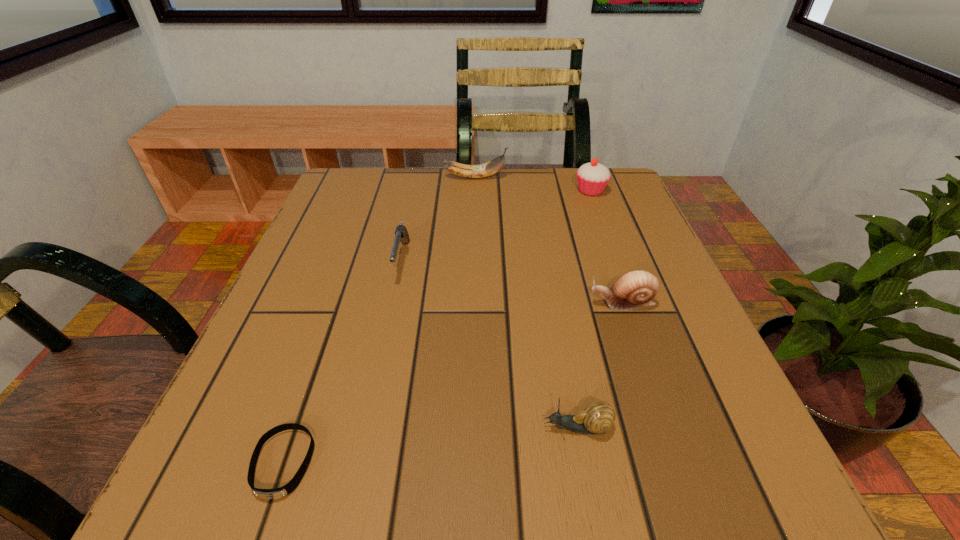
At what (x,y) coordinates should I click in order to perform the action: click on blank space at the left edge of the desktop. Please return your answer as a coordinate pair (x, y). The image size is (960, 540). Looking at the image, I should click on (306, 259).

The height and width of the screenshot is (540, 960). I want to click on vacant region at the right edge of the desktop, so click(716, 362).

Identify the location of blank space at the far left corner. Image resolution: width=960 pixels, height=540 pixels. (354, 180).

Identify the location of vacant space at the far right corner of the desktop. Image resolution: width=960 pixels, height=540 pixels. (635, 212).

Locate an element on the screen. Image resolution: width=960 pixels, height=540 pixels. empty space between the right escargot and the banana is located at coordinates (548, 240).

What are the coordinates of `free space between the right escargot and the left escargot` in the screenshot? It's located at (600, 366).

I want to click on vacant region between the leftmost object and the fourth nearest object, so click(343, 362).

The image size is (960, 540). Identify the location of unoccupied area between the shortest object and the third farthest object. (343, 362).

Find the location of a particular element. The width and height of the screenshot is (960, 540). free space between the farther escargot and the fifth object from right to left is located at coordinates pyautogui.click(x=512, y=282).

Where is `free area in between the fourth object from right to left and the nearer escargot`? The image size is (960, 540). free area in between the fourth object from right to left and the nearer escargot is located at coordinates (526, 303).